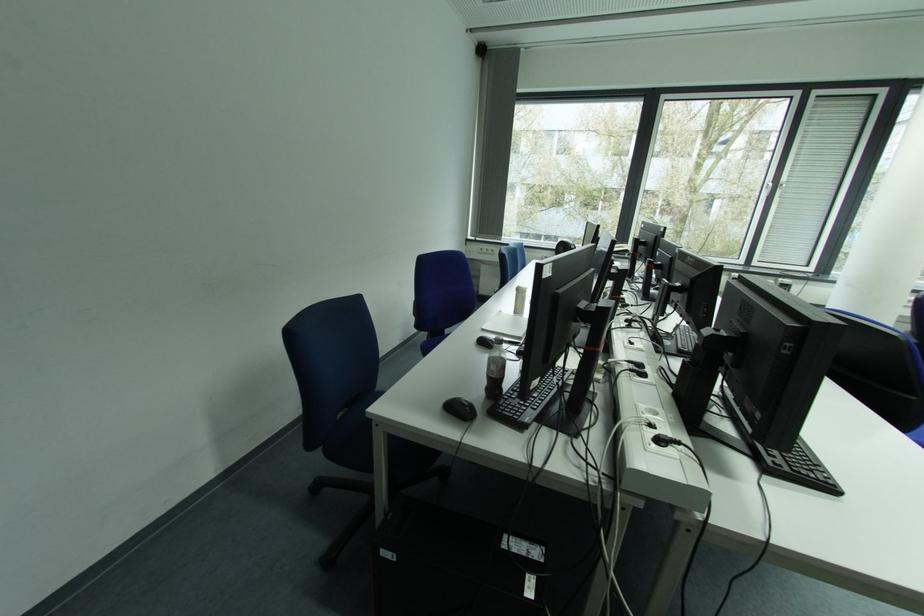
Image resolution: width=924 pixels, height=616 pixels. What do you see at coordinates (523, 546) in the screenshot?
I see `the power strip switch` at bounding box center [523, 546].